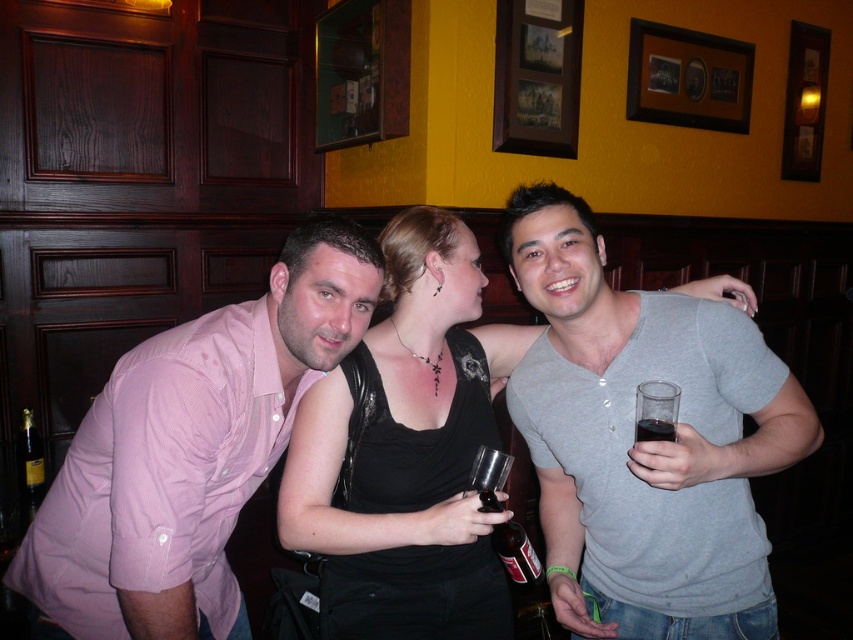
Is pink cotton shirt at left below gold foil champagne bottle at lower left?

Incorrect, pink cotton shirt at left is not positioned below gold foil champagne bottle at lower left.

Can you confirm if pink cotton shirt at left is shorter than gold foil champagne bottle at lower left?

In fact, pink cotton shirt at left may be taller than gold foil champagne bottle at lower left.

Is point (160, 490) farther from camera compared to point (42, 477)?

No, it is in front of (42, 477).

The width and height of the screenshot is (853, 640). I want to click on pink cotton shirt at left, so click(190, 451).

From the picture: Can you confirm if pink cotton shirt at left is wider than clear glass bottle at center?

Yes, pink cotton shirt at left is wider than clear glass bottle at center.

Is point (140, 586) farther from viewer compared to point (525, 536)?

That is False.

Where is `pink cotton shirt at left`? pink cotton shirt at left is located at coordinates (190, 451).

Is pink cotton shirt at left to the right of dark glass at right from the viewer's perspective?

No, pink cotton shirt at left is not to the right of dark glass at right.

Is point (274, 406) positioned before point (654, 433)?

No.

In order to click on pink cotton shirt at left in this screenshot , I will do `click(190, 451)`.